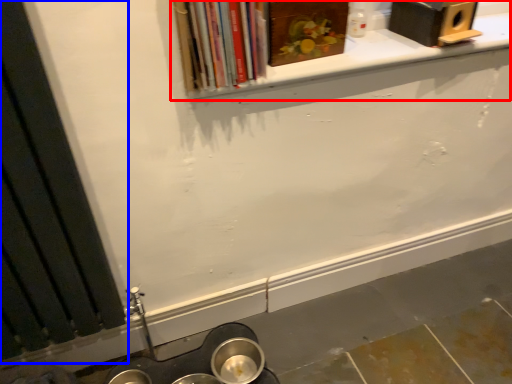
Question: Which of the following is the farthest to the observer, window sill (highlighted by a red box) or window frame (highlighted by a blue box)?

Choices:
 (A) window sill
 (B) window frame

Answer: (A)